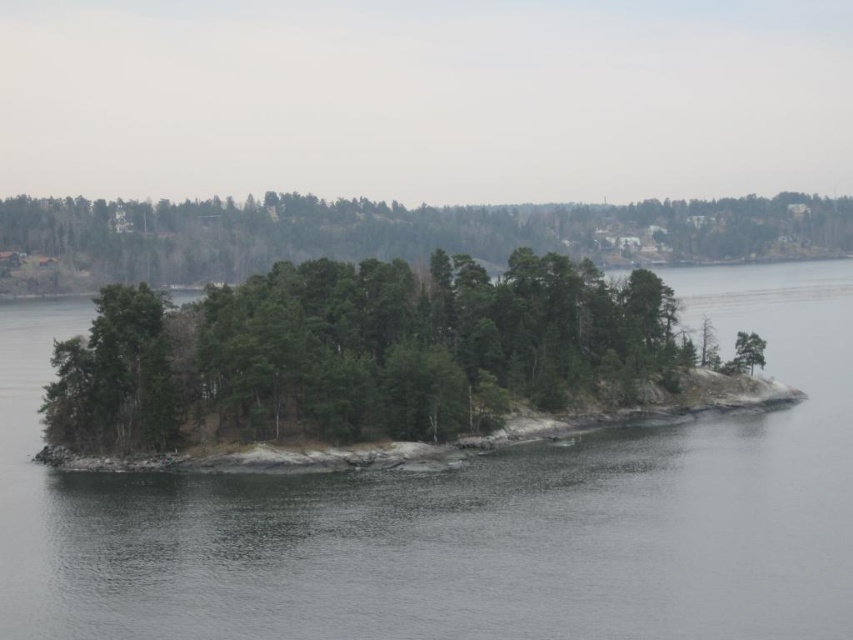
Who is positioned more to the left, green matte trees at upper center or green matte tree at left?

green matte tree at left

Can you confirm if green matte trees at upper center is thinner than green matte tree at left?

No, green matte trees at upper center is not thinner than green matte tree at left.

Which is in front, point (653, 204) or point (78, 422)?

Positioned in front is point (78, 422).

Identify the location of green matte trees at upper center. Image resolution: width=853 pixels, height=640 pixels. (387, 234).

Based on the photo, does gray water at center have a larger size compared to green matte trees at upper center?

No, gray water at center is not bigger than green matte trees at upper center.

Is gray water at center to the left of green matte trees at upper center from the viewer's perspective?

Incorrect, gray water at center is not on the left side of green matte trees at upper center.

Who is more forward, (601, 513) or (503, 230)?

Point (601, 513)

Find the location of `gray water at center`. gray water at center is located at coordinates (466, 515).

Does gray water at center appear on the left side of green matte tree at left?

No, gray water at center is not to the left of green matte tree at left.

At what (x,y) coordinates should I click in order to perform the action: click on gray water at center. Please return your answer as a coordinate pair (x, y). This screenshot has height=640, width=853. Looking at the image, I should click on (466, 515).

Where is `gray water at center`? gray water at center is located at coordinates (466, 515).